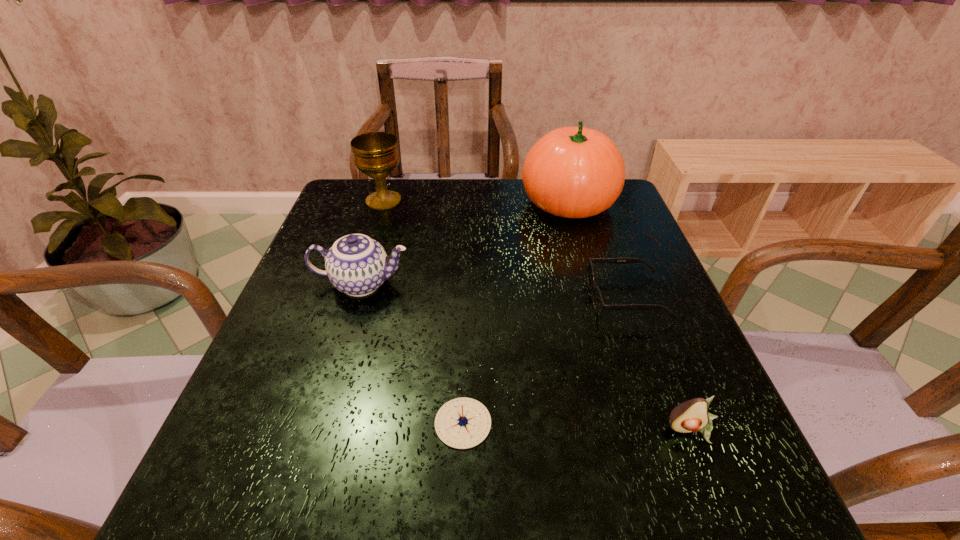
Find the location of a particular element. The height and width of the screenshot is (540, 960). the tallest object is located at coordinates (574, 172).

This screenshot has width=960, height=540. I want to click on chalice, so click(x=376, y=154).

Where is `chinaware`? This screenshot has height=540, width=960. chinaware is located at coordinates (357, 265).

Find the location of `the fourth tallest object`. the fourth tallest object is located at coordinates [690, 416].

Find the location of a particular element. The width and height of the screenshot is (960, 540). sunglasses is located at coordinates (598, 302).

The width and height of the screenshot is (960, 540). What are the coordinates of `compass` in the screenshot? It's located at (462, 423).

What are the coordinates of `blank area located 0.340m on the left of the pumpkin` in the screenshot? It's located at (398, 203).

The width and height of the screenshot is (960, 540). I want to click on vacant space situated 0.380m on the right of the second tallest object, so click(x=540, y=201).

Find the location of a particular element. The image size is (960, 540). vacant region located at the spout of the third tallest object is located at coordinates (542, 284).

Locate an element on the screen. The width and height of the screenshot is (960, 540). vacant area situated 0.070m on the seed side of the avocado is located at coordinates (715, 489).